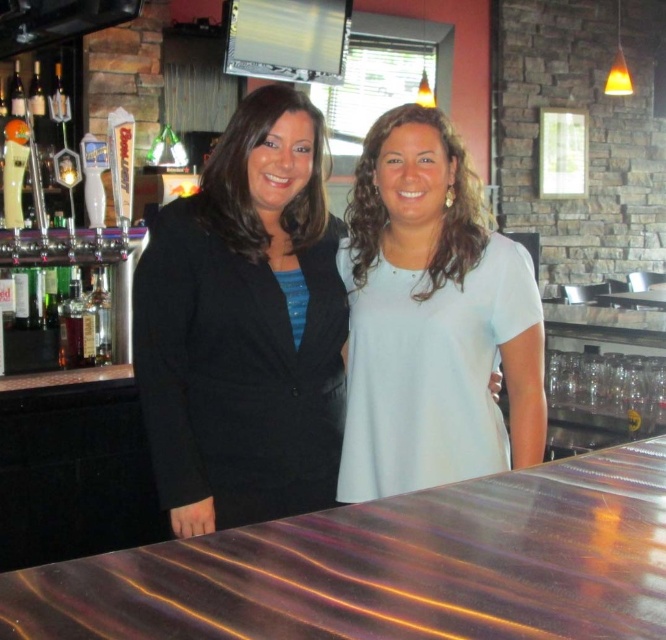
Question: Is black fabric jacket at center positioned behind light blue fabric shirt at center?

Choices:
 (A) no
 (B) yes

Answer: (A)

Question: Is black fabric jacket at center to the right of light blue fabric shirt at center from the viewer's perspective?

Choices:
 (A) yes
 (B) no

Answer: (B)

Question: Can you confirm if black fabric jacket at center is positioned to the right of light blue fabric shirt at center?

Choices:
 (A) no
 (B) yes

Answer: (A)